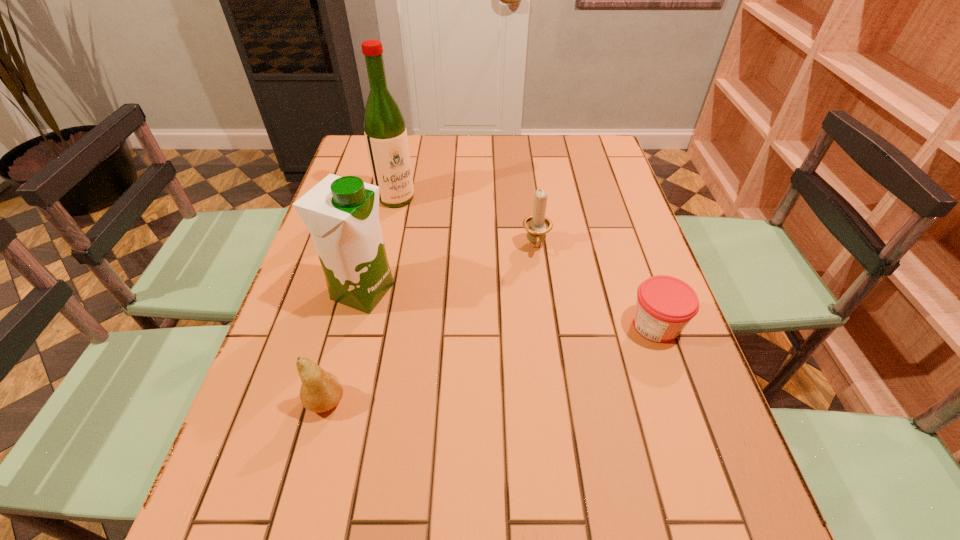
Where is `vacant area that lies between the rightmost object and the soya milk`? The height and width of the screenshot is (540, 960). vacant area that lies between the rightmost object and the soya milk is located at coordinates (510, 308).

The width and height of the screenshot is (960, 540). Find the location of `free space between the jam and the third tallest object`. free space between the jam and the third tallest object is located at coordinates (596, 286).

Locate an element on the screen. vacant space that's between the shortest object and the second shortest object is located at coordinates (491, 363).

The height and width of the screenshot is (540, 960). I want to click on object that can be found as the fourth closest to the rightmost object, so click(x=385, y=132).

At what (x,y) coordinates should I click in order to perform the action: click on object identified as the second closest to the fourth object from left to right. Please return your answer as a coordinate pair (x, y). The width and height of the screenshot is (960, 540). Looking at the image, I should click on (341, 213).

Locate an element on the screen. The width and height of the screenshot is (960, 540). vacant point that satisfies the following two spatial constraints: 1. on the front side of the second tallest object; 2. on the label side of the jam is located at coordinates (354, 325).

Identify the location of vacant space that satisfies the following two spatial constraints: 1. on the front side of the farthest object; 2. on the left side of the second object from right to left. (386, 247).

You are a GUI agent. You are given a task and a screenshot of the screen. Output one action in this format:
    pyautogui.click(x=<x>, y=<y>)
    Task: Click on the free location that satisfies the following two spatial constraints: 1. on the back side of the nearest object; 2. on the left side of the liquor
    The width and height of the screenshot is (960, 540).
    Given the screenshot: What is the action you would take?
    pyautogui.click(x=380, y=198)

Where is `vacant area that satisfies the following two spatial constraints: 1. on the back side of the shortest object; 2. on the label side of the nearest object`? vacant area that satisfies the following two spatial constraints: 1. on the back side of the shortest object; 2. on the label side of the nearest object is located at coordinates (347, 325).

Image resolution: width=960 pixels, height=540 pixels. Find the location of `vacant point that satisfies the following two spatial constraints: 1. on the back side of the second shortest object; 2. on the right side of the candle_holder`. vacant point that satisfies the following two spatial constraints: 1. on the back side of the second shortest object; 2. on the right side of the candle_holder is located at coordinates (367, 247).